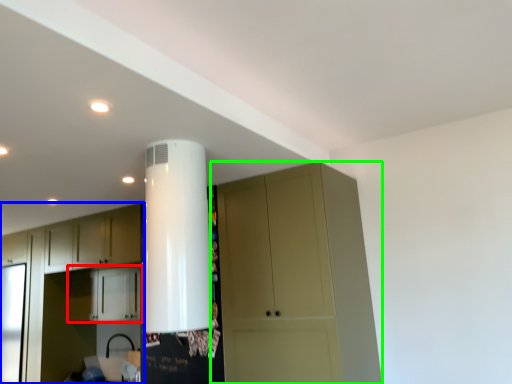
Question: Which object is positioned farthest from cabinetry (highlighted by a red box)? Select from cabinetry (highlighted by a blue box) and cupboard (highlighted by a green box).

Choices:
 (A) cabinetry
 (B) cupboard

Answer: (B)